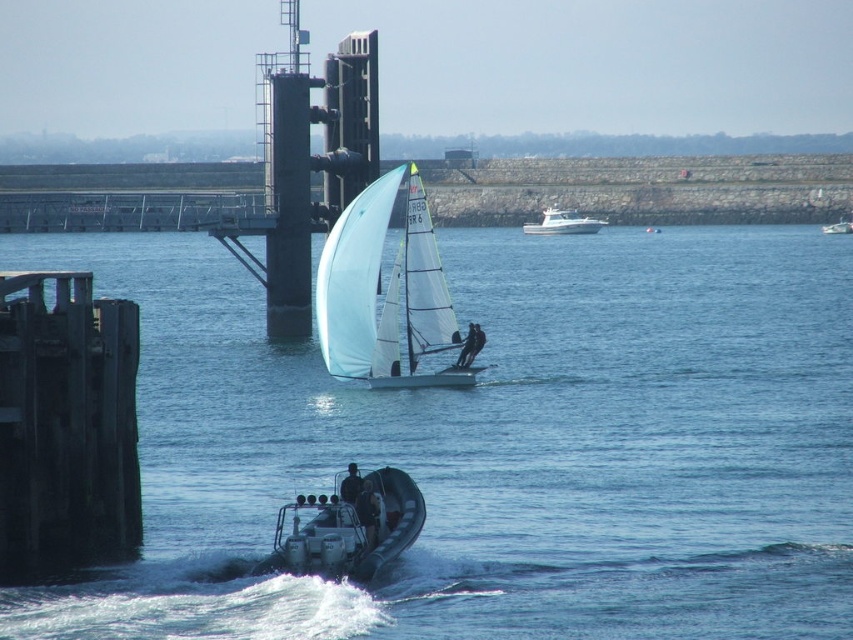
You are standing on a dock and see the smooth white sail at center in the water. If you want to throw a lifebuoy to the sail, will it reach the sail?

The smooth white sail at center is 56.87 meters away from the viewer. The average throwing distance of a lifebuoy is around 20 meters, so it is unlikely to reach the sail.

Consider the image. You are a sailor on the dock observing the sailboat and motorboat. Which object, the smooth white sail at center or the black fabric sailboat at center, is positioned closer to you?

The smooth white sail at center is closer to the viewer than the black fabric sailboat at center, so the smooth white sail at center is positioned closer to you.

You are a sailor trying to navigate a narrow channel between two docks. You see the white glossy boat at upper center and the smooth white sail at center. Which object should you avoid hitting first?

You should avoid hitting the white glossy boat at upper center first because it is closer to you than the smooth white sail at center, which is positioned behind it.